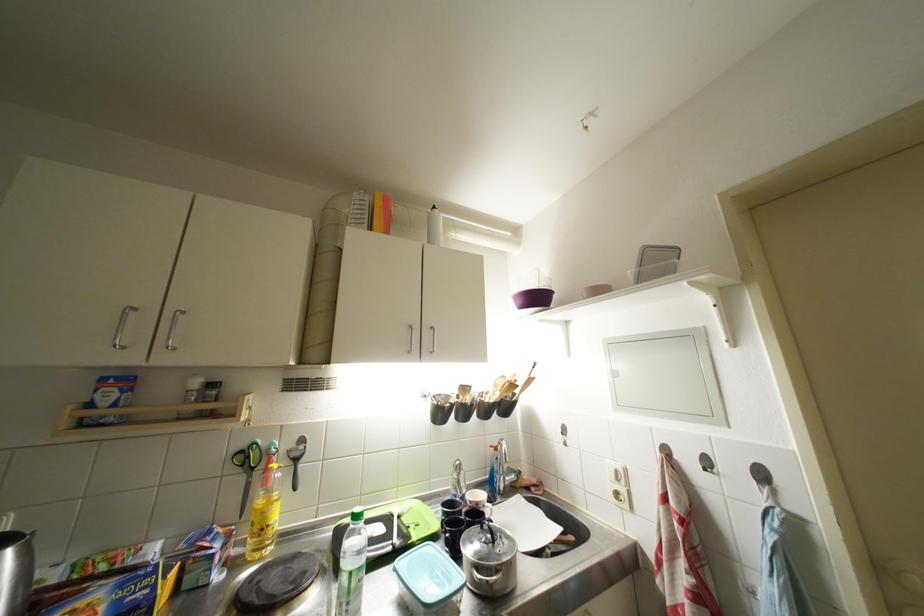
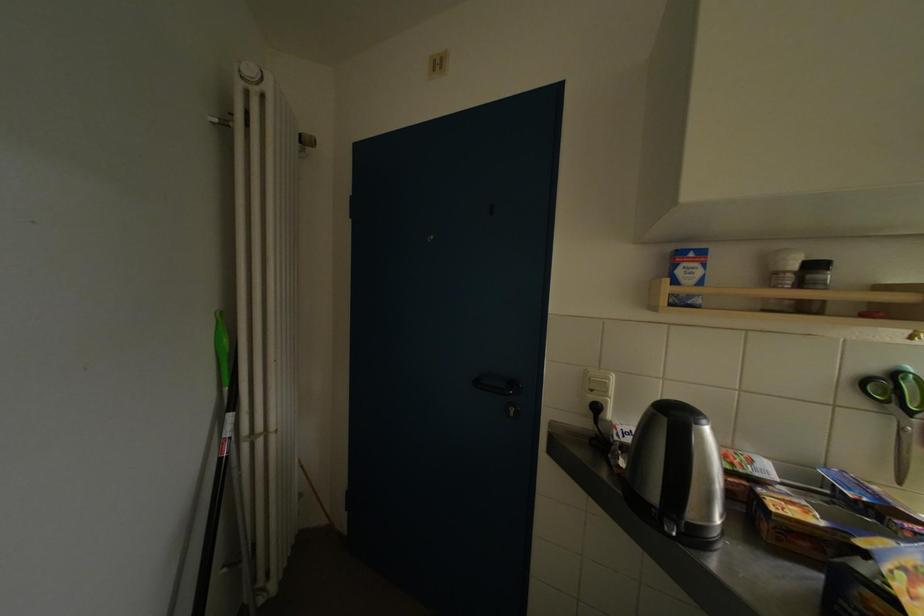
Find the pixel in the second image that matches point 195,395 in the first image.

(784, 277)